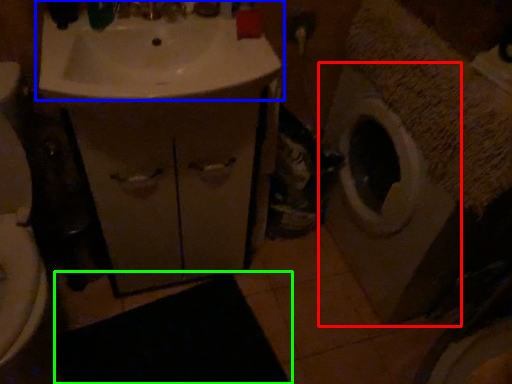
Question: Which is farther away from washing machine (highlighted by a red box)? sink (highlighted by a blue box) or bath mat (highlighted by a green box)?

Choices:
 (A) sink
 (B) bath mat

Answer: (B)